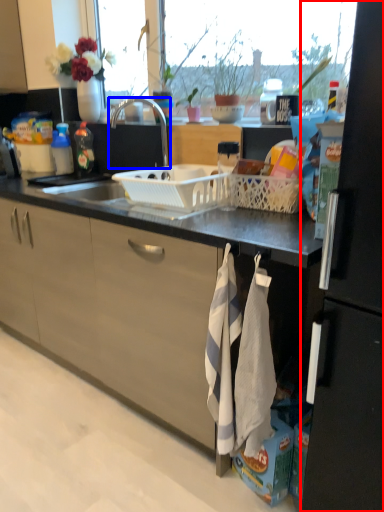
Question: Which object appears closest to the camera in this image, refrigerator (highlighted by a red box) or tap (highlighted by a blue box)?

Choices:
 (A) refrigerator
 (B) tap

Answer: (A)